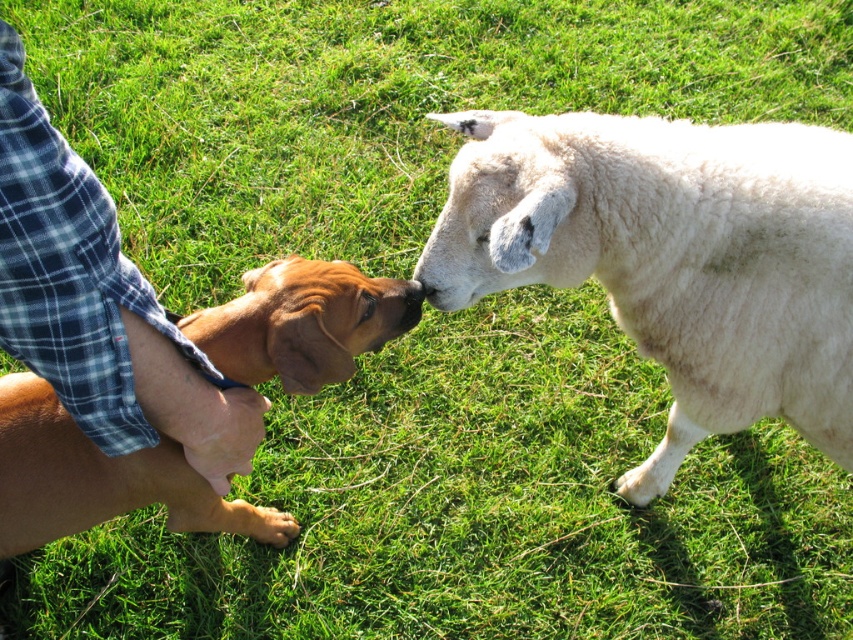
Does brown furry dog at left have a larger size compared to black smooth nose at center?

Yes.

Between brown furry dog at left and black smooth nose at center, which one appears on the left side from the viewer's perspective?

Positioned to the left is brown furry dog at left.

Where is `brown furry dog at left`? This screenshot has height=640, width=853. brown furry dog at left is located at coordinates (99, 480).

Which is below, blue plaid shirt at lower left or brown furry dog at left?

brown furry dog at left is below.

At what (x,y) coordinates should I click in order to perform the action: click on blue plaid shirt at lower left. Please return your answer as a coordinate pair (x, y). Looking at the image, I should click on (99, 304).

How far apart are white woolen sheep at center and brown furry dog at left?

white woolen sheep at center is 21.96 inches away from brown furry dog at left.

Can you confirm if white woolen sheep at center is positioned below brown furry dog at left?

No, white woolen sheep at center is not below brown furry dog at left.

Locate an element on the screen. The width and height of the screenshot is (853, 640). white woolen sheep at center is located at coordinates (671, 257).